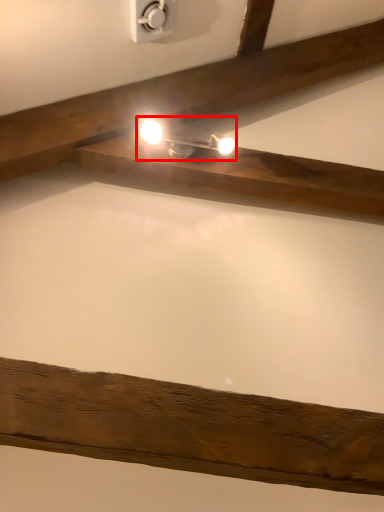
Question: From the image's perspective, where is light fixture (annotated by the red box) located in relation to power plugs and sockets in the image?

Choices:
 (A) below
 (B) above

Answer: (A)